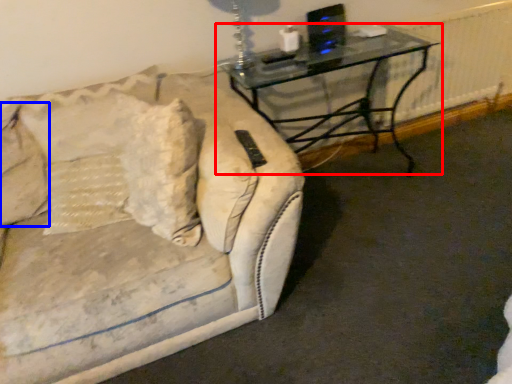
Question: Which object is closer to the camera taking this photo, table (highlighted by a red box) or pillow (highlighted by a blue box)?

Choices:
 (A) table
 (B) pillow

Answer: (B)